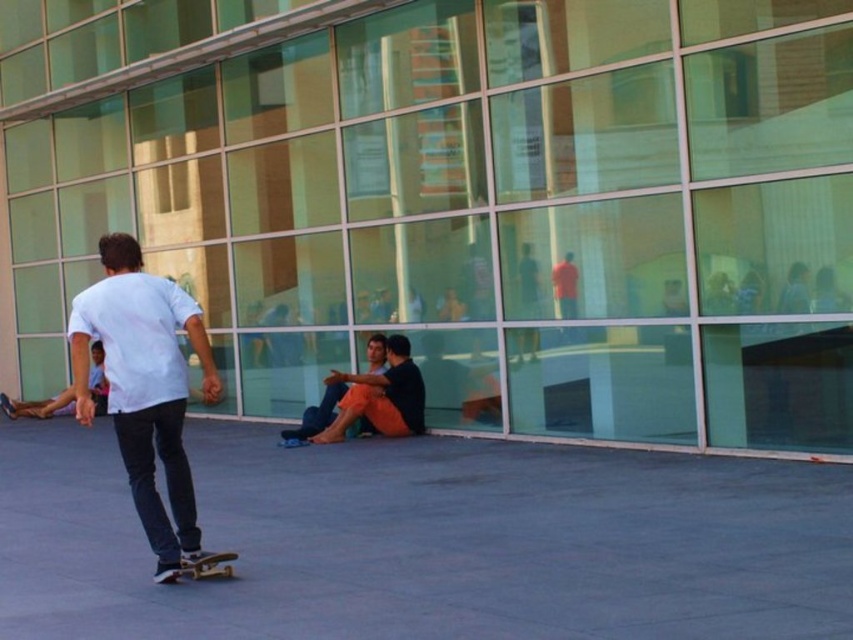
Between white matte shirt at center and orange cotton pants at center, which one is positioned higher?

Positioned higher is white matte shirt at center.

Who is shorter, white matte shirt at center or orange cotton pants at center?

orange cotton pants at center is shorter.

Measure the distance between white matte shirt at center and camera.

The distance of white matte shirt at center from camera is 5.57 meters.

Identify the location of white matte shirt at center. Image resolution: width=853 pixels, height=640 pixels. (144, 385).

Can you confirm if orange cotton pants at center is taller than wooden deck skateboard at lower center?

Indeed, orange cotton pants at center has a greater height compared to wooden deck skateboard at lower center.

Is point (408, 428) more distant than point (225, 572)?

Yes, point (408, 428) is farther from viewer.

Who is more distant from viewer, (396, 364) or (218, 563)?

Positioned behind is point (396, 364).

Locate an element on the screen. This screenshot has width=853, height=640. orange cotton pants at center is located at coordinates (380, 396).

Who is more distant from viewer, (132, 348) or (178, 570)?

The point (178, 570) is more distant.

Who is more forward, (131, 243) or (219, 573)?

Point (219, 573) is more forward.

Which is behind, point (161, 458) or point (219, 577)?

Positioned behind is point (161, 458).

Locate an element on the screen. The image size is (853, 640). white matte shirt at center is located at coordinates (144, 385).